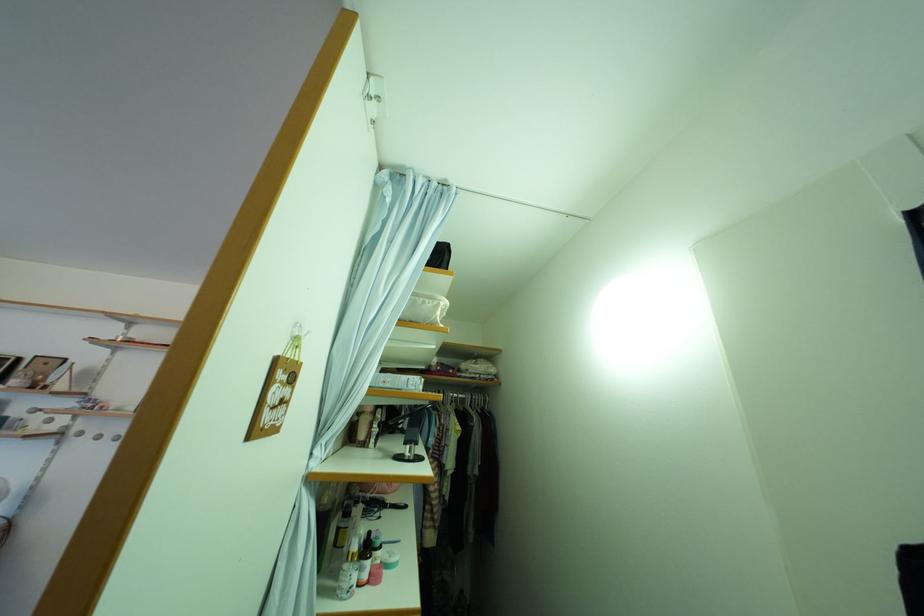
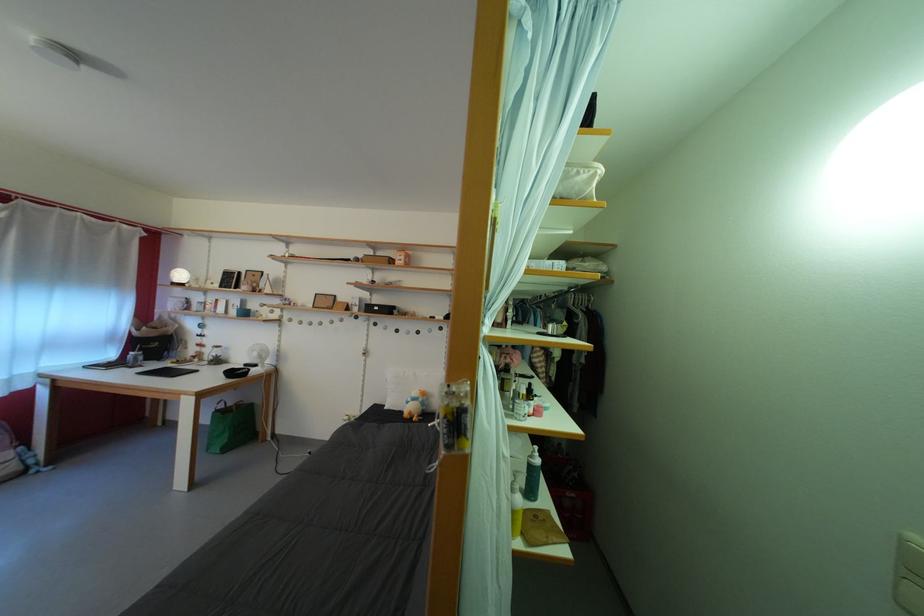
Consider the image. Based on the continuous images, in which direction is the camera rotating?

The camera rotated toward left-down.